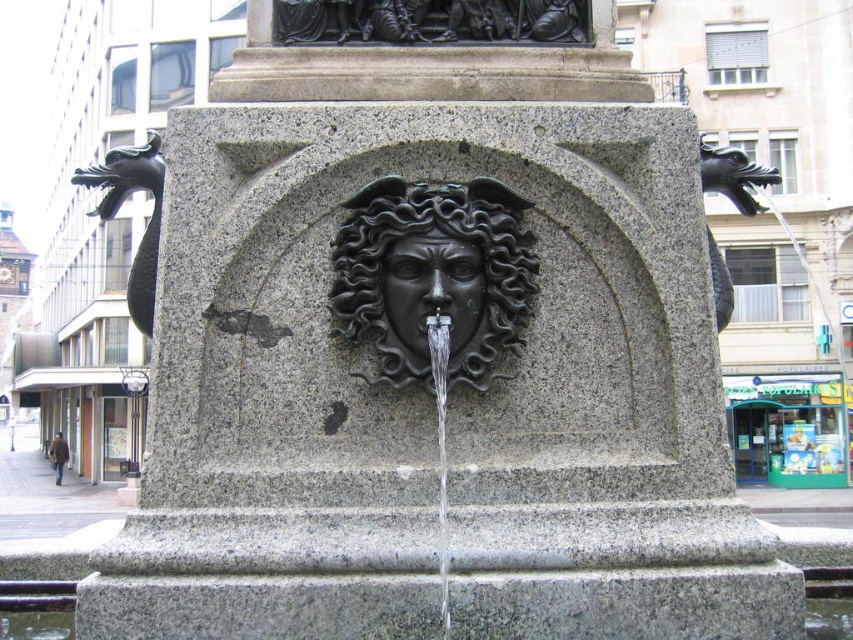
Question: Does black polished stone lion at center appear over black polished stone face at center?

Choices:
 (A) yes
 (B) no

Answer: (A)

Question: Does black polished stone lion at center have a smaller size compared to black polished stone face at center?

Choices:
 (A) no
 (B) yes

Answer: (A)

Question: Can you confirm if black polished stone lion at center is positioned to the left of black polished stone face at center?

Choices:
 (A) yes
 (B) no

Answer: (A)

Question: Which point appears closest to the camera in this image?

Choices:
 (A) (471, 320)
 (B) (479, 296)

Answer: (A)

Question: Among these points, which one is nearest to the camera?

Choices:
 (A) (431, 269)
 (B) (405, 380)

Answer: (B)

Question: Which point is farther to the camera?

Choices:
 (A) (503, 296)
 (B) (421, 264)

Answer: (A)